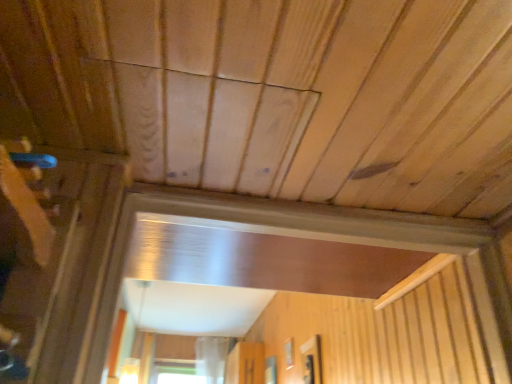
Question: Is transparent glass window at center, the third window from the front, at the left side of transparent plastic screen door at center?

Choices:
 (A) no
 (B) yes

Answer: (A)

Question: Could you tell me if transparent glass window at center, which is the first window from left to right, is facing transparent plastic screen door at center?

Choices:
 (A) no
 (B) yes

Answer: (A)

Question: Considering the relative sizes of transparent glass window at center, which ranks as the third window in right-to-left order, and transparent plastic screen door at center in the image provided, is transparent glass window at center, which ranks as the third window in right-to-left order, smaller than transparent plastic screen door at center?

Choices:
 (A) yes
 (B) no

Answer: (A)

Question: Does transparent glass window at center, which is the first window from left to right, touch transparent plastic screen door at center?

Choices:
 (A) no
 (B) yes

Answer: (A)

Question: Is transparent glass window at center, which ranks as the third window in right-to-left order, turned away from transparent plastic screen door at center?

Choices:
 (A) no
 (B) yes

Answer: (A)

Question: Is transparent glass window at center, which ranks as the third window in right-to-left order, bigger than transparent plastic screen door at center?

Choices:
 (A) yes
 (B) no

Answer: (B)

Question: Is transparent glass window at center, the 3th window in the back-to-front sequence, completely or partially inside transparent plastic screen door at center?

Choices:
 (A) no
 (B) yes

Answer: (A)

Question: Would you say transparent plastic screen door at center is a long distance from transparent glass window at center, the 3th window positioned from the left?

Choices:
 (A) no
 (B) yes

Answer: (B)

Question: From the image's perspective, is transparent plastic screen door at center located above transparent glass window at center, the 3th window positioned from the left?

Choices:
 (A) no
 (B) yes

Answer: (A)

Question: From a real-world perspective, is transparent plastic screen door at center over transparent glass window at center, positioned as the 1th window in front-to-back order?

Choices:
 (A) yes
 (B) no

Answer: (A)

Question: Is transparent plastic screen door at center positioned with its back to transparent glass window at center, which is the 1th window in right-to-left order?

Choices:
 (A) yes
 (B) no

Answer: (B)

Question: Is transparent plastic screen door at center wider than transparent glass window at center, the 3th window positioned from the left?

Choices:
 (A) yes
 (B) no

Answer: (A)

Question: Considering the relative sizes of transparent glass window at center, which is the 1th window in right-to-left order, and transparent glass window at center, the third window from the front, in the image provided, is transparent glass window at center, which is the 1th window in right-to-left order, shorter than transparent glass window at center, the third window from the front,?

Choices:
 (A) yes
 (B) no

Answer: (B)